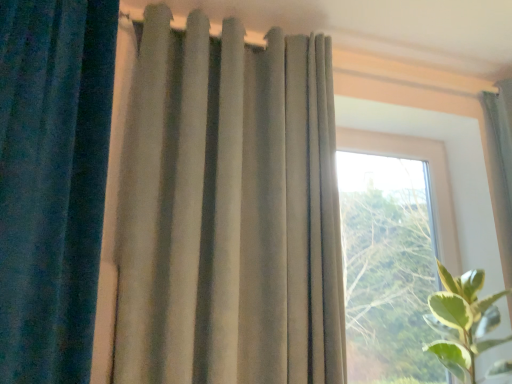
Identify the location of suede-like beige curtain at center, marked as the second curtain in a right-to-left arrangement. (229, 211).

The image size is (512, 384). What do you see at coordinates (462, 322) in the screenshot? I see `green leafy plant at right` at bounding box center [462, 322].

Find the location of `transparent glass window at center`. transparent glass window at center is located at coordinates (393, 252).

Between suede-like beige curtain at center, marked as the second curtain in a right-to-left arrangement, and satin beige curtain at upper right, the 3th curtain in the left-to-right sequence, which one has more height?

suede-like beige curtain at center, marked as the second curtain in a right-to-left arrangement.

In the scene shown: Would you consider suede-like beige curtain at center, acting as the second curtain starting from the left, to be distant from satin beige curtain at upper right, the 3th curtain in the left-to-right sequence?

Yes, suede-like beige curtain at center, acting as the second curtain starting from the left, and satin beige curtain at upper right, the 3th curtain in the left-to-right sequence, are located far from each other.

In the scene shown: Considering the sizes of suede-like beige curtain at center, acting as the second curtain starting from the left, and satin beige curtain at upper right, the 3th curtain in the left-to-right sequence, in the image, is suede-like beige curtain at center, acting as the second curtain starting from the left, wider or thinner than satin beige curtain at upper right, the 3th curtain in the left-to-right sequence,?

In the image, suede-like beige curtain at center, acting as the second curtain starting from the left, appears to be more narrow than satin beige curtain at upper right, the 3th curtain in the left-to-right sequence.

Does point (443, 303) come in front of point (499, 238)?

Yes, point (443, 303) is in front of point (499, 238).

Find the location of a particular element. The width and height of the screenshot is (512, 384). curtain to the right of green leafy plant at right is located at coordinates (501, 166).

From a real-world perspective, who is located lower, green leafy plant at right or satin beige curtain at upper right, placed as the first curtain when sorted from right to left?

In real-world perspective, green leafy plant at right is lower.

Based on the photo, does suede-like beige curtain at center, acting as the second curtain starting from the left, have a larger size compared to green leafy plant at right?

Correct, suede-like beige curtain at center, acting as the second curtain starting from the left, is larger in size than green leafy plant at right.

How far apart are suede-like beige curtain at center, acting as the second curtain starting from the left, and green leafy plant at right?

suede-like beige curtain at center, acting as the second curtain starting from the left, and green leafy plant at right are 35.78 inches apart.

Can you confirm if suede-like beige curtain at center, acting as the second curtain starting from the left, is taller than green leafy plant at right?

Yes.

Considering the relative positions of suede-like beige curtain at center, acting as the second curtain starting from the left, and green leafy plant at right in the image provided, is suede-like beige curtain at center, acting as the second curtain starting from the left, to the left of green leafy plant at right from the viewer's perspective?

Correct, you'll find suede-like beige curtain at center, acting as the second curtain starting from the left, to the left of green leafy plant at right.

Considering the sizes of objects green leafy plant at right and velvet blue curtain at left, which appears as the third curtain when viewed from the right, in the image provided, who is thinner, green leafy plant at right or velvet blue curtain at left, which appears as the third curtain when viewed from the right,?

velvet blue curtain at left, which appears as the third curtain when viewed from the right.

Does point (468, 300) appear closer or farther from the camera than point (30, 66)?

Point (468, 300) appears to be farther away from the viewer than point (30, 66).

Would you say green leafy plant at right is outside velvet blue curtain at left, arranged as the first curtain when viewed from the left?

That's correct, green leafy plant at right is outside of velvet blue curtain at left, arranged as the first curtain when viewed from the left.

From a real-world perspective, count 1st curtains upward from the green leafy plant at right and point to it. Please provide its 2D coordinates.

[(52, 182)]

Which object is closer to the camera taking this photo, velvet blue curtain at left, arranged as the first curtain when viewed from the left, or suede-like beige curtain at center, marked as the second curtain in a right-to-left arrangement?

velvet blue curtain at left, arranged as the first curtain when viewed from the left, is closer to the camera.

Does velvet blue curtain at left, arranged as the first curtain when viewed from the left, contain suede-like beige curtain at center, acting as the second curtain starting from the left?

No, suede-like beige curtain at center, acting as the second curtain starting from the left, is not surrounded by velvet blue curtain at left, arranged as the first curtain when viewed from the left.

Between velvet blue curtain at left, which appears as the third curtain when viewed from the right, and suede-like beige curtain at center, marked as the second curtain in a right-to-left arrangement, which one appears on the left side from the viewer's perspective?

velvet blue curtain at left, which appears as the third curtain when viewed from the right.

Are velvet blue curtain at left, which appears as the third curtain when viewed from the right, and suede-like beige curtain at center, marked as the second curtain in a right-to-left arrangement, making contact?

No, velvet blue curtain at left, which appears as the third curtain when viewed from the right, is not making contact with suede-like beige curtain at center, marked as the second curtain in a right-to-left arrangement.

Which of these two, satin beige curtain at upper right, the 3th curtain in the left-to-right sequence, or green leafy plant at right, is thinner?

Thinner between the two is satin beige curtain at upper right, the 3th curtain in the left-to-right sequence.

Considering the sizes of satin beige curtain at upper right, the 3th curtain in the left-to-right sequence, and green leafy plant at right in the image, is satin beige curtain at upper right, the 3th curtain in the left-to-right sequence, bigger or smaller than green leafy plant at right?

In the image, satin beige curtain at upper right, the 3th curtain in the left-to-right sequence, appears to be smaller than green leafy plant at right.

Is satin beige curtain at upper right, placed as the first curtain when sorted from right to left, turned away from green leafy plant at right?

That's not correct — satin beige curtain at upper right, placed as the first curtain when sorted from right to left, is not looking away from green leafy plant at right.

Is green leafy plant at right a part of satin beige curtain at upper right, the 3th curtain in the left-to-right sequence?

No.

Is point (101, 179) farther from camera compared to point (503, 195)?

No, it is in front of (503, 195).

Is velvet blue curtain at left, which appears as the third curtain when viewed from the right, not close to satin beige curtain at upper right, the 3th curtain in the left-to-right sequence?

That's right, there is a large distance between velvet blue curtain at left, which appears as the third curtain when viewed from the right, and satin beige curtain at upper right, the 3th curtain in the left-to-right sequence.

Considering the sizes of objects velvet blue curtain at left, arranged as the first curtain when viewed from the left, and satin beige curtain at upper right, placed as the first curtain when sorted from right to left, in the image provided, who is shorter, velvet blue curtain at left, arranged as the first curtain when viewed from the left, or satin beige curtain at upper right, placed as the first curtain when sorted from right to left,?

With less height is satin beige curtain at upper right, placed as the first curtain when sorted from right to left.

Consider the image. Who is bigger, velvet blue curtain at left, arranged as the first curtain when viewed from the left, or satin beige curtain at upper right, the 3th curtain in the left-to-right sequence?

velvet blue curtain at left, arranged as the first curtain when viewed from the left, is bigger.

You are a GUI agent. You are given a task and a screenshot of the screen. Output one action in this format:
    pyautogui.click(x=<x>, y=<y>)
    Task: Click on the curtain that appears below the suede-like beige curtain at center, marked as the second curtain in a right-to-left arrangement (from the image's perspective)
    
    Given the screenshot: What is the action you would take?
    pyautogui.click(x=501, y=166)

From a real-world perspective, count 3rd curtains upward from the green leafy plant at right and point to it. Please provide its 2D coordinates.

[(501, 166)]

Based on their spatial positions, is suede-like beige curtain at center, marked as the second curtain in a right-to-left arrangement, or satin beige curtain at upper right, the 3th curtain in the left-to-right sequence, closer to transparent glass window at center?

The object closer to transparent glass window at center is satin beige curtain at upper right, the 3th curtain in the left-to-right sequence.

Which object lies nearer to the anchor point satin beige curtain at upper right, the 3th curtain in the left-to-right sequence, green leafy plant at right or suede-like beige curtain at center, acting as the second curtain starting from the left?

green leafy plant at right is positioned closer to the anchor satin beige curtain at upper right, the 3th curtain in the left-to-right sequence.

Which object lies nearer to the anchor point transparent glass window at center, velvet blue curtain at left, which appears as the third curtain when viewed from the right, or suede-like beige curtain at center, marked as the second curtain in a right-to-left arrangement?

suede-like beige curtain at center, marked as the second curtain in a right-to-left arrangement.

From the image, which object appears to be nearer to transparent glass window at center, green leafy plant at right or satin beige curtain at upper right, the 3th curtain in the left-to-right sequence?

Based on the image, green leafy plant at right appears to be nearer to transparent glass window at center.

Based on their spatial positions, is suede-like beige curtain at center, marked as the second curtain in a right-to-left arrangement, or green leafy plant at right closer to transparent glass window at center?

green leafy plant at right is positioned closer to the anchor transparent glass window at center.

From the image, which object appears to be nearer to transparent glass window at center, velvet blue curtain at left, arranged as the first curtain when viewed from the left, or satin beige curtain at upper right, the 3th curtain in the left-to-right sequence?

satin beige curtain at upper right, the 3th curtain in the left-to-right sequence, is closer to transparent glass window at center.

From the image, which object appears to be farther from green leafy plant at right, satin beige curtain at upper right, placed as the first curtain when sorted from right to left, or transparent glass window at center?

The object further to green leafy plant at right is transparent glass window at center.

Based on their spatial positions, is suede-like beige curtain at center, marked as the second curtain in a right-to-left arrangement, or transparent glass window at center further from velvet blue curtain at left, which appears as the third curtain when viewed from the right?

transparent glass window at center lies further to velvet blue curtain at left, which appears as the third curtain when viewed from the right, than the other object.

Where is `houseplant between velvet blue curtain at left, arranged as the first curtain when viewed from the left, and satin beige curtain at upper right, placed as the first curtain when sorted from right to left`? This screenshot has width=512, height=384. houseplant between velvet blue curtain at left, arranged as the first curtain when viewed from the left, and satin beige curtain at upper right, placed as the first curtain when sorted from right to left is located at coordinates (462, 322).

This screenshot has height=384, width=512. I want to click on houseplant between suede-like beige curtain at center, marked as the second curtain in a right-to-left arrangement, and satin beige curtain at upper right, the 3th curtain in the left-to-right sequence, from left to right, so [x=462, y=322].

The width and height of the screenshot is (512, 384). I want to click on window between velvet blue curtain at left, which appears as the third curtain when viewed from the right, and green leafy plant at right, in the horizontal direction, so click(x=393, y=252).

Locate an element on the screen. The image size is (512, 384). window situated between suede-like beige curtain at center, marked as the second curtain in a right-to-left arrangement, and green leafy plant at right from left to right is located at coordinates (393, 252).